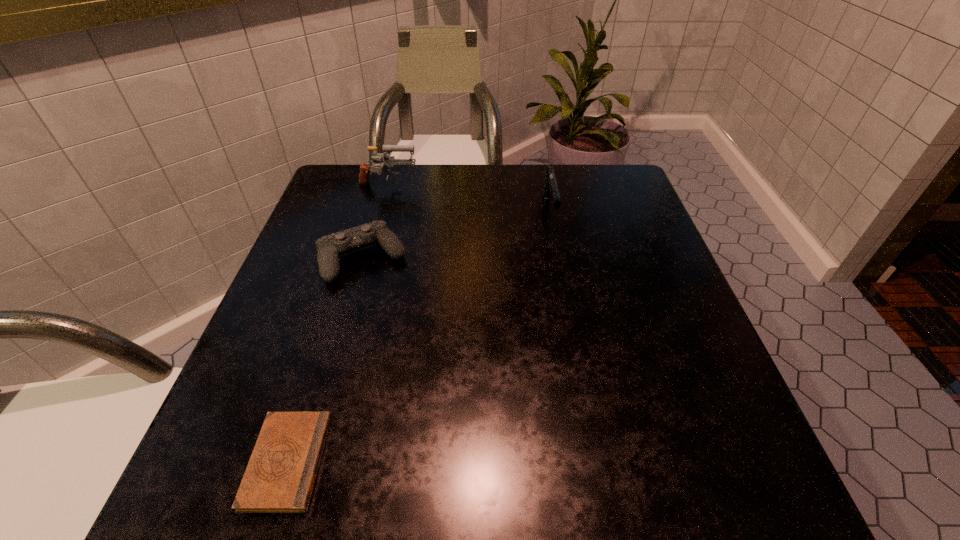
Identify the location of vacant point located on the back of the second nearest object. This screenshot has height=540, width=960. (385, 182).

Identify the location of free point located on the spine side of the shortest object. This screenshot has width=960, height=540. (419, 461).

Image resolution: width=960 pixels, height=540 pixels. What are the coordinates of `object that is at the near edge` in the screenshot? It's located at (280, 476).

At what (x,y) coordinates should I click in order to perform the action: click on gun that is at the left edge. Please return your answer as a coordinate pair (x, y). The image size is (960, 540). Looking at the image, I should click on (389, 161).

You are a GUI agent. You are given a task and a screenshot of the screen. Output one action in this format:
    pyautogui.click(x=<x>, y=<y>)
    Task: Click on the control that is at the left edge
    
    Given the screenshot: What is the action you would take?
    pyautogui.click(x=330, y=247)

Locate an element on the screen. The image size is (960, 540). diary that is at the left edge is located at coordinates (280, 476).

Identify the location of object that is at the far left corner. (389, 161).

The height and width of the screenshot is (540, 960). I want to click on object that is at the near left corner, so click(x=280, y=476).

Where is `vacant position at the far edge of the desktop`? The width and height of the screenshot is (960, 540). vacant position at the far edge of the desktop is located at coordinates (435, 168).

The image size is (960, 540). In the image, there is a desktop. In order to click on vacant space at the near edge in this screenshot , I will do point(413,495).